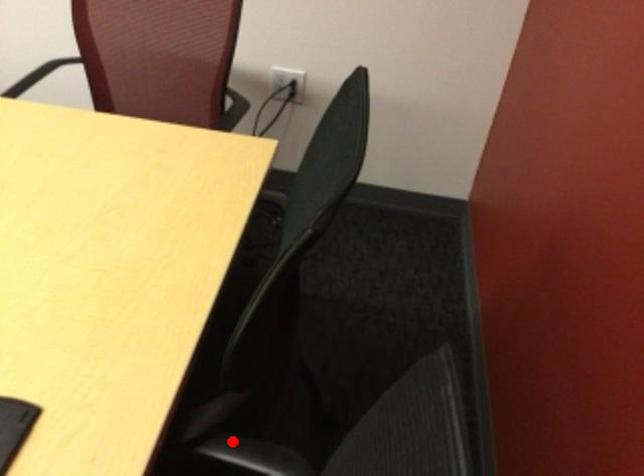
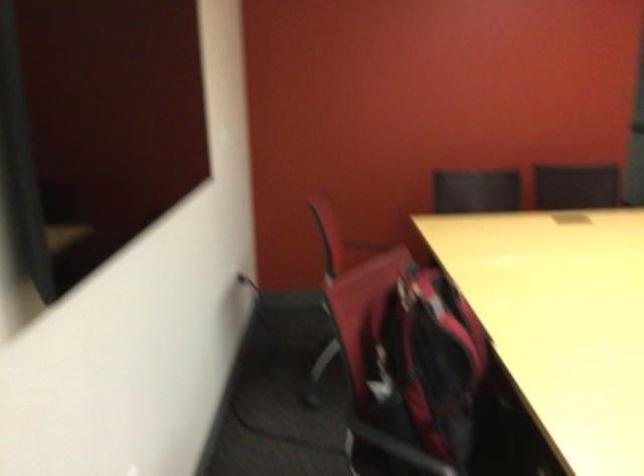
Question: I am providing you with two images of the same scene from different viewpoints. A red point is marked on the first image. Is the red point's position out of view in image 2?

Choices:
 (A) Yes
 (B) No

Answer: (A)